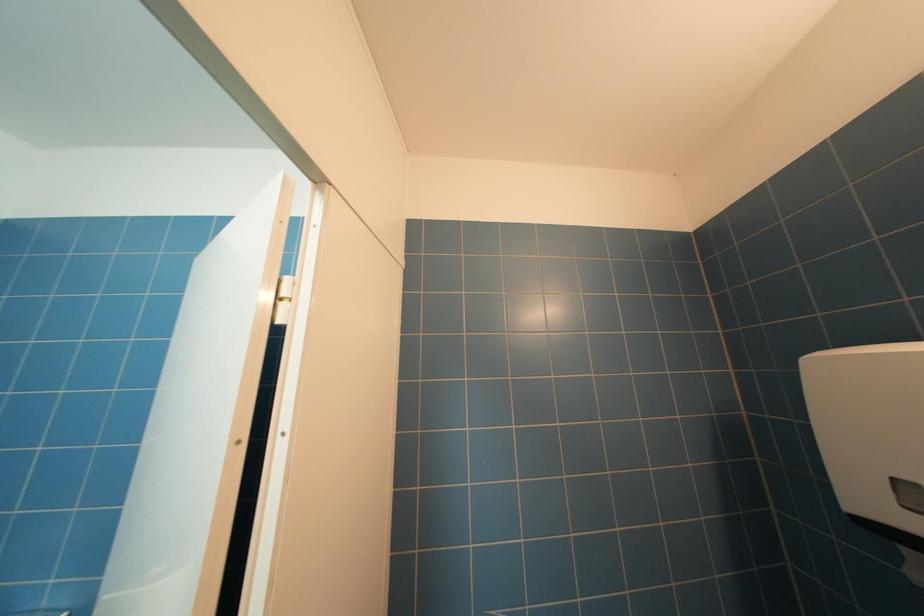
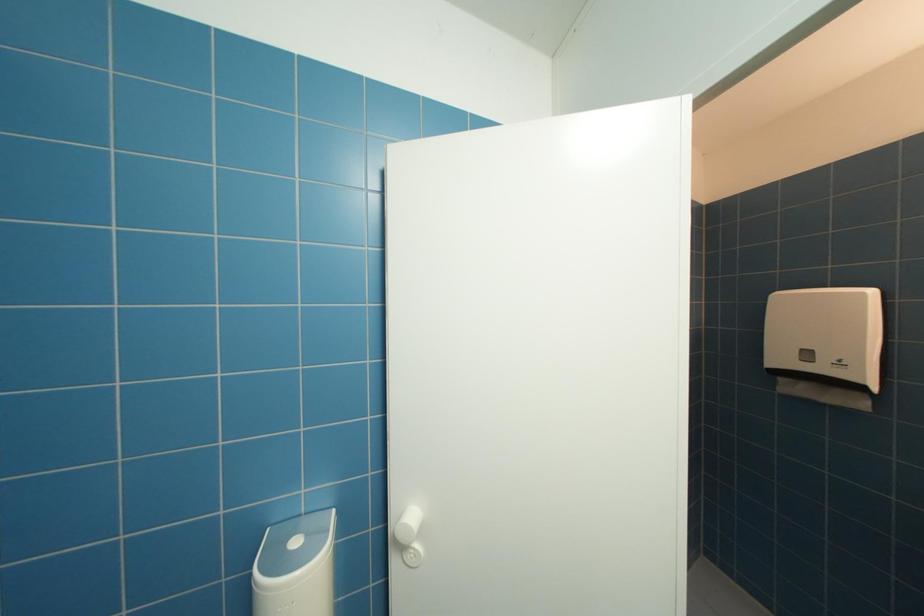
Question: The images are taken continuously from a first-person perspective. In which direction are you moving?

Choices:
 (A) Left
 (B) Right
 (C) Forward
 (D) Backward

Answer: (A)